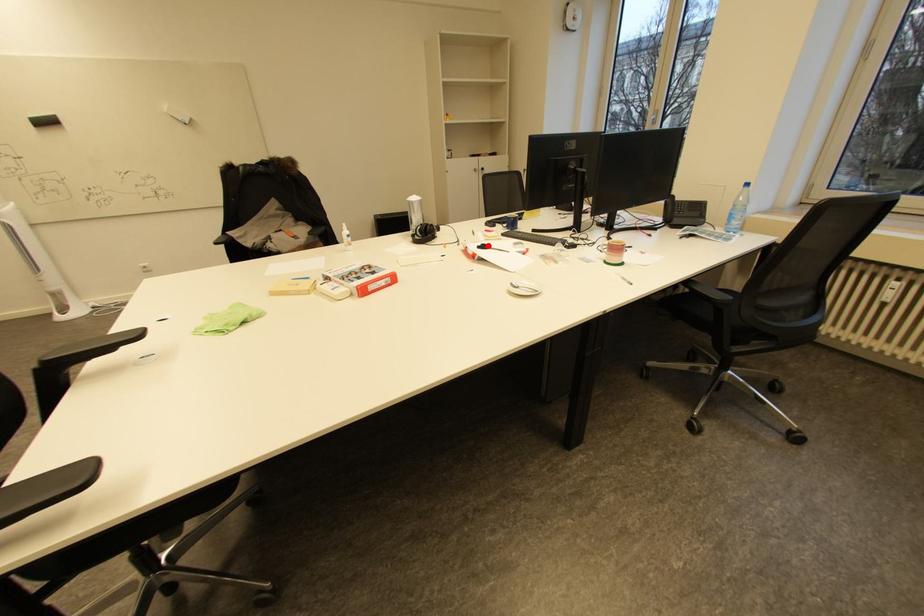
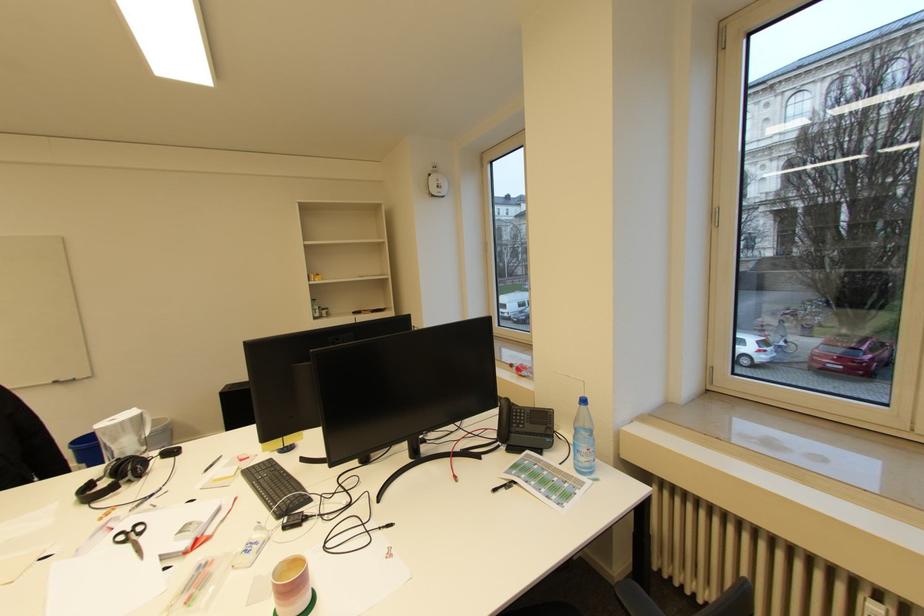
Question: I am providing you with two images of the same scene from different viewpoints. A red point is marked on the first image. Can you still see the location of the red point in image 2?

Choices:
 (A) Yes
 (B) No

Answer: (A)